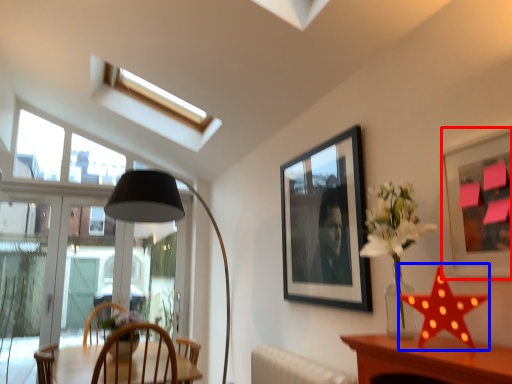
Question: Which object is closer to the camera taking this photo, picture frame (highlighted by a red box) or star (highlighted by a blue box)?

Choices:
 (A) picture frame
 (B) star

Answer: (A)